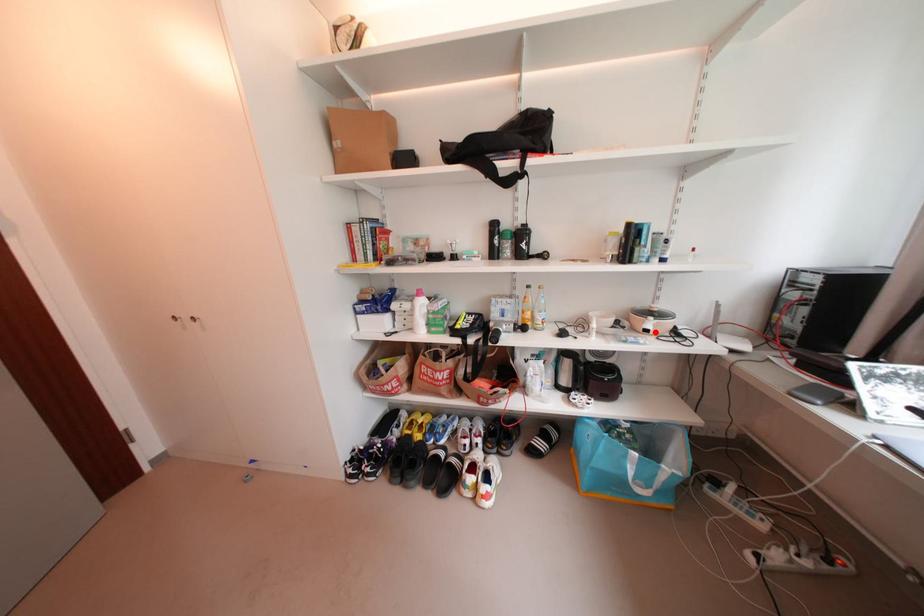
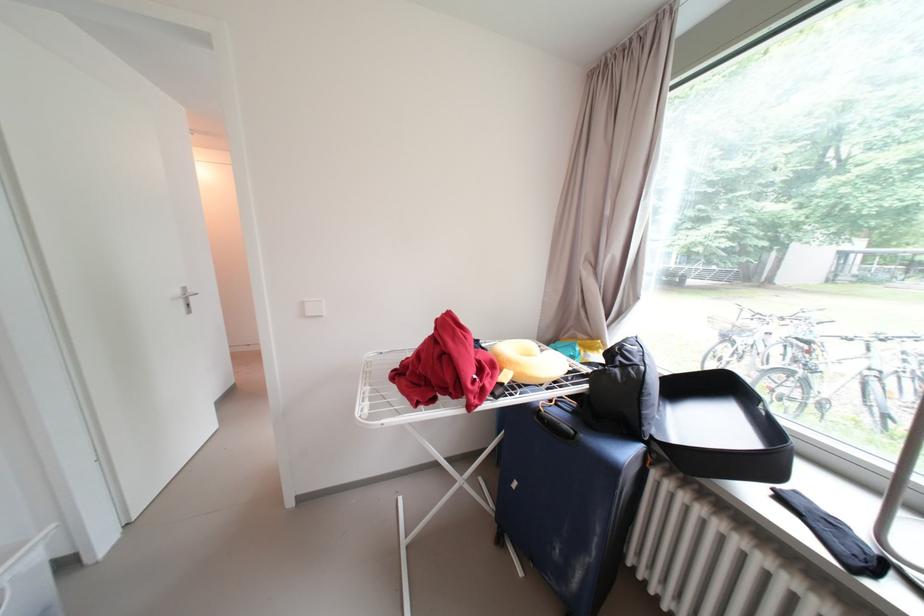
Question: I am providing you with two images of the same scene from different viewpoints. A red point is marked on the first image. At the location where the point appears in image 1, is it still visible in image 2?

Choices:
 (A) Yes
 (B) No

Answer: (B)